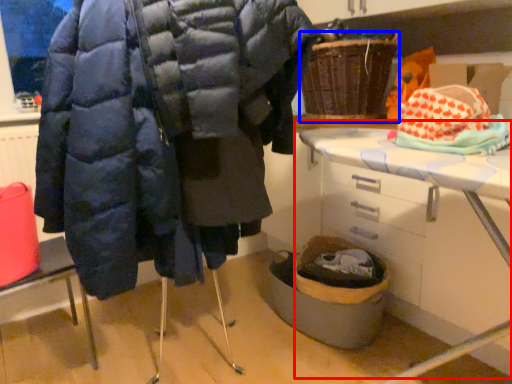
Question: Which of the following is the farthest to the observer, table (highlighted by a red box) or basket (highlighted by a blue box)?

Choices:
 (A) table
 (B) basket

Answer: (B)